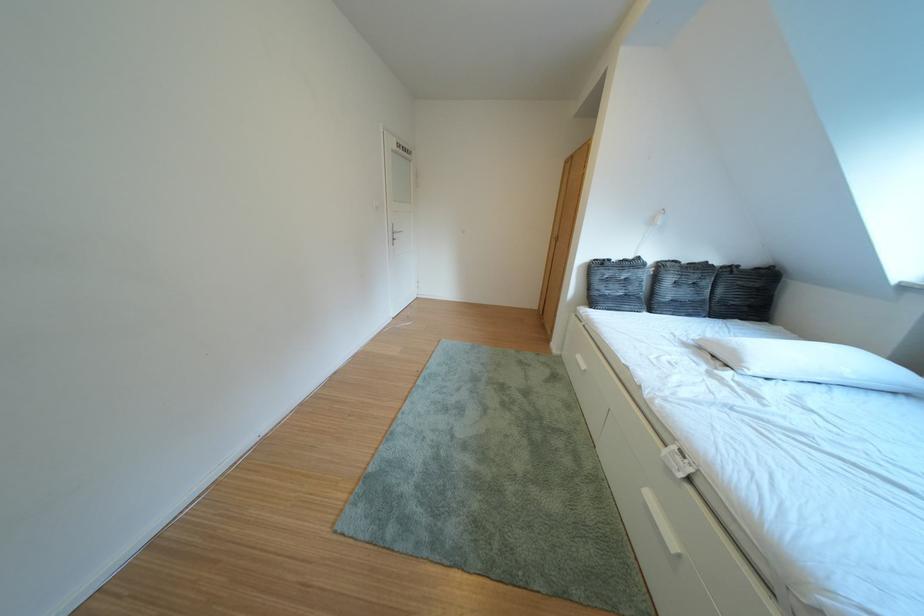
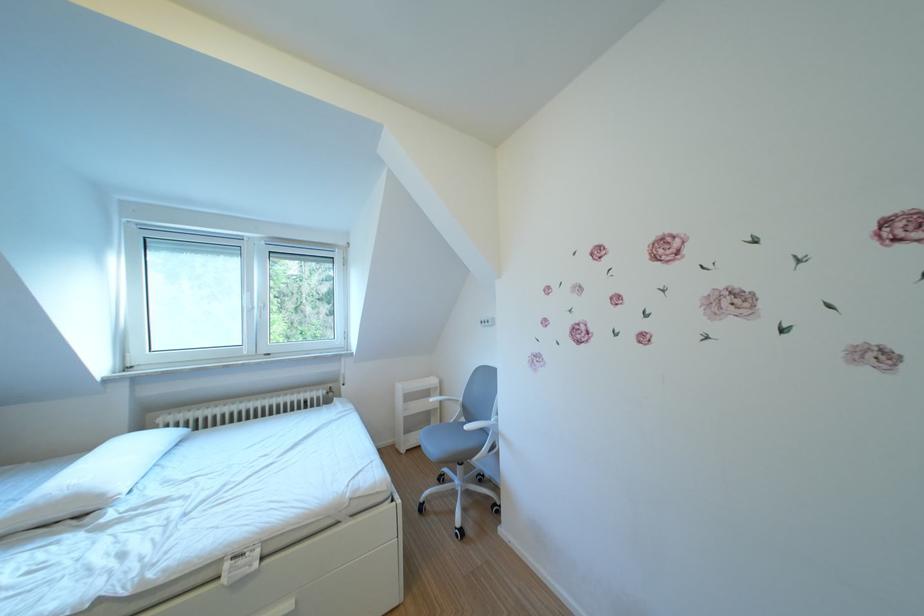
The point at (755, 366) is marked in the first image. Where is the corresponding point in the second image?

(115, 501)